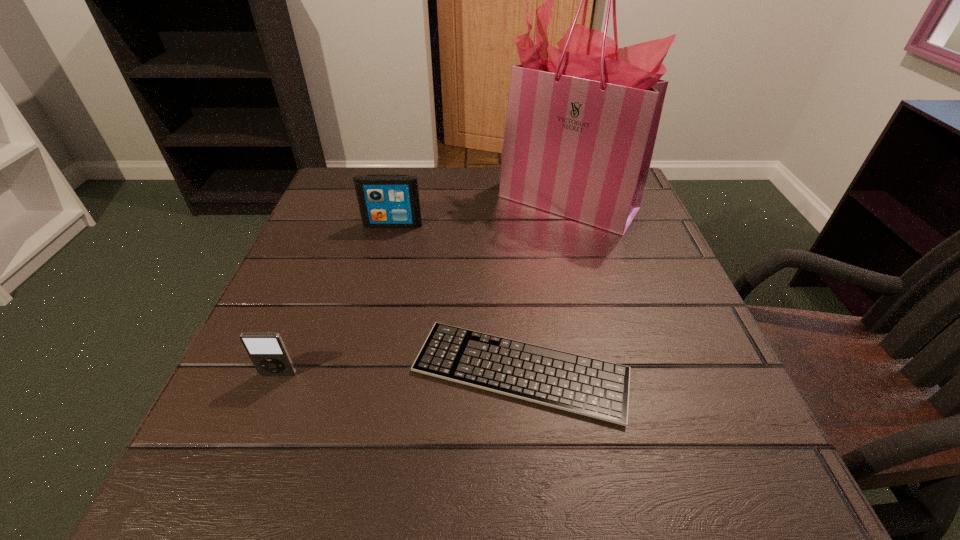
Image resolution: width=960 pixels, height=540 pixels. I want to click on object positioned at the far edge, so click(x=582, y=120).

The width and height of the screenshot is (960, 540). I want to click on shopping bag present at the right edge, so click(x=582, y=120).

Identify the location of computer keyboard that is at the right edge. (599, 389).

This screenshot has width=960, height=540. What are the coordinates of `object that is at the far right corner` in the screenshot? It's located at (582, 120).

In the image, there is a desktop. Identify the location of vacant region at the far edge. Image resolution: width=960 pixels, height=540 pixels. (455, 188).

The image size is (960, 540). I want to click on vacant space at the near edge of the desktop, so click(516, 503).

Identify the location of vacant area at the left edge of the desktop. This screenshot has height=540, width=960. (248, 436).

The image size is (960, 540). In order to click on free spot at the right edge of the desktop in this screenshot , I will do `click(638, 316)`.

At what (x,y) coordinates should I click in order to perform the action: click on vacant space at the near right corner of the desktop. Please return your answer as a coordinate pair (x, y). Looking at the image, I should click on (728, 476).

This screenshot has width=960, height=540. In order to click on unoccupied area between the farther iPod and the tallest object in this screenshot , I will do `click(480, 213)`.